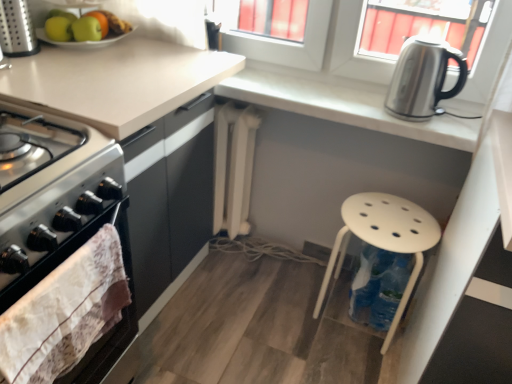
Question: From the image's perspective, would you say white matte radiator at center is shown under green matte apple at upper left, the second apple in the right-to-left sequence?

Choices:
 (A) no
 (B) yes

Answer: (B)

Question: Is white matte radiator at center behind green matte apple at upper left, the second apple in the right-to-left sequence?

Choices:
 (A) no
 (B) yes

Answer: (B)

Question: Does white matte radiator at center have a lesser height compared to green matte apple at upper left, acting as the second apple starting from the left?

Choices:
 (A) no
 (B) yes

Answer: (A)

Question: Is white matte radiator at center aimed at green matte apple at upper left, acting as the second apple starting from the left?

Choices:
 (A) yes
 (B) no

Answer: (B)

Question: Is white matte radiator at center not near green matte apple at upper left, the second apple in the right-to-left sequence?

Choices:
 (A) yes
 (B) no

Answer: (B)

Question: Considering the positions of point tap(101, 11) and point tap(382, 112), is point tap(101, 11) closer or farther from the camera than point tap(382, 112)?

Choices:
 (A) closer
 (B) farther

Answer: (B)

Question: From a real-world perspective, relative to satin white countertop at upper right, is green matte apple at upper left vertically above or below?

Choices:
 (A) above
 (B) below

Answer: (A)

Question: Considering the positions of green matte apple at upper left and satin white countertop at upper right in the image, is green matte apple at upper left taller or shorter than satin white countertop at upper right?

Choices:
 (A) tall
 (B) short

Answer: (A)

Question: Do you think green matte apple at upper left is within satin white countertop at upper right, or outside of it?

Choices:
 (A) inside
 (B) outside

Answer: (B)

Question: From a real-world perspective, relative to white fabric towel at left, is satin white countertop at upper right vertically above or below?

Choices:
 (A) below
 (B) above

Answer: (B)

Question: Does point 318,107 appear closer or farther from the camera than point 57,302?

Choices:
 (A) closer
 (B) farther

Answer: (B)

Question: Based on their positions, is satin white countertop at upper right located to the left or right of white fabric towel at left?

Choices:
 (A) left
 (B) right

Answer: (B)

Question: Is satin white countertop at upper right in front of or behind white fabric towel at left in the image?

Choices:
 (A) front
 (B) behind

Answer: (B)

Question: In terms of width, does white plastic stool at lower right look wider or thinner when compared to green matte apple at upper left, acting as the third apple starting from the right?

Choices:
 (A) thin
 (B) wide

Answer: (B)

Question: Is white plastic stool at lower right to the left or to the right of green matte apple at upper left, acting as the third apple starting from the right, in the image?

Choices:
 (A) right
 (B) left

Answer: (A)